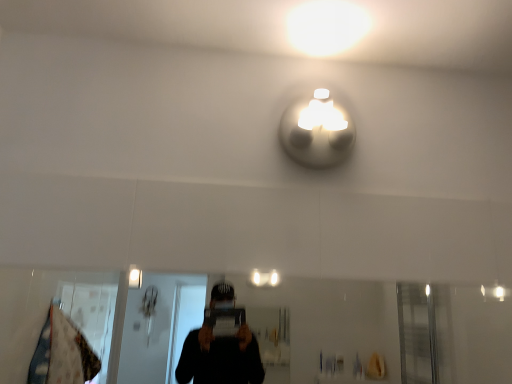
At what (x,y) coordinates should I click in order to perform the action: click on transparent glass mirror at lower center. Please return your answer as a coordinate pair (x, y). Looking at the image, I should click on (381, 330).

What do you see at coordinates (381, 330) in the screenshot?
I see `transparent glass mirror at lower center` at bounding box center [381, 330].

In order to face transparent glass mirror at lower center, should I rotate leftwards or rightwards?

Turn right by 2.178 degrees to look at transparent glass mirror at lower center.

What do you see at coordinates (317, 130) in the screenshot?
I see `white glossy light fixture at upper center` at bounding box center [317, 130].

Where is `white glossy light fixture at upper center`? This screenshot has height=384, width=512. white glossy light fixture at upper center is located at coordinates (317, 130).

I want to click on transparent glass mirror at lower center, so [x=381, y=330].

Which object is positioned more to the right, white glossy light fixture at upper center or transparent glass mirror at lower center?

Positioned to the right is white glossy light fixture at upper center.

Does white glossy light fixture at upper center lie in front of transparent glass mirror at lower center?

No, it is behind transparent glass mirror at lower center.

Considering the points (297, 118) and (418, 339), which point is behind, point (297, 118) or point (418, 339)?

The point (418, 339) is behind.

From the image's perspective, is white glossy light fixture at upper center over transparent glass mirror at lower center?

Yes.

From a real-world perspective, does white glossy light fixture at upper center sit lower than transparent glass mirror at lower center?

No, from a real-world perspective, white glossy light fixture at upper center is not beneath transparent glass mirror at lower center.

Can you confirm if white glossy light fixture at upper center is thinner than transparent glass mirror at lower center?

No.

From the picture: Can you confirm if white glossy light fixture at upper center is shorter than transparent glass mirror at lower center?

Yes, white glossy light fixture at upper center is shorter than transparent glass mirror at lower center.

Who is bigger, white glossy light fixture at upper center or transparent glass mirror at lower center?

With larger size is transparent glass mirror at lower center.

Does white glossy light fixture at upper center contain transparent glass mirror at lower center?

No, transparent glass mirror at lower center is not a part of white glossy light fixture at upper center.

Would you say white glossy light fixture at upper center is a long distance from transparent glass mirror at lower center?

Indeed, white glossy light fixture at upper center is not near transparent glass mirror at lower center.

Is white glossy light fixture at upper center oriented away from transparent glass mirror at lower center?

white glossy light fixture at upper center does not have its back to transparent glass mirror at lower center.

How different are the orientations of white glossy light fixture at upper center and transparent glass mirror at lower center in degrees?

0.00135 degrees.

Looking at this image, how much distance is there between white glossy light fixture at upper center and transparent glass mirror at lower center?

white glossy light fixture at upper center and transparent glass mirror at lower center are 5.32 feet apart from each other.

This screenshot has height=384, width=512. I want to click on light lying above the transparent glass mirror at lower center (from the image's perspective), so click(317, 130).

Which object is positioned more to the left, transparent glass mirror at lower center or white glossy light fixture at upper center?

transparent glass mirror at lower center is more to the left.

Is transparent glass mirror at lower center in front of or behind white glossy light fixture at upper center in the image?

In the image, transparent glass mirror at lower center appears in front of white glossy light fixture at upper center.

Which is less distant, (245,305) or (287,138)?

The point (287,138) is closer to the camera.

From the image's perspective, is transparent glass mirror at lower center located beneath white glossy light fixture at upper center?

Yes.

From a real-world perspective, is transparent glass mirror at lower center positioned under white glossy light fixture at upper center based on gravity?

Indeed, from a real-world perspective, transparent glass mirror at lower center is positioned beneath white glossy light fixture at upper center.

Considering the sizes of objects transparent glass mirror at lower center and white glossy light fixture at upper center in the image provided, who is thinner, transparent glass mirror at lower center or white glossy light fixture at upper center?

transparent glass mirror at lower center is thinner.

In the scene shown: Can you confirm if transparent glass mirror at lower center is shorter than white glossy light fixture at upper center?

No, transparent glass mirror at lower center is not shorter than white glossy light fixture at upper center.

Looking at the image, does transparent glass mirror at lower center seem bigger or smaller compared to white glossy light fixture at upper center?

In the image, transparent glass mirror at lower center appears to be larger than white glossy light fixture at upper center.

Is white glossy light fixture at upper center inside transparent glass mirror at lower center?

No, white glossy light fixture at upper center is not a part of transparent glass mirror at lower center.

Would you say transparent glass mirror at lower center is a long distance from white glossy light fixture at upper center?

transparent glass mirror at lower center is far away from white glossy light fixture at upper center.

Is transparent glass mirror at lower center looking in the opposite direction of white glossy light fixture at upper center?

No, transparent glass mirror at lower center is not facing the opposite direction of white glossy light fixture at upper center.

Locate an element on the screen. The width and height of the screenshot is (512, 384). mirror that appears in front of the white glossy light fixture at upper center is located at coordinates (381, 330).

You are a GUI agent. You are given a task and a screenshot of the screen. Output one action in this format:
    pyautogui.click(x=<x>, y=<y>)
    Task: Click on the light above the transparent glass mirror at lower center (from the image's perspective)
    The height and width of the screenshot is (384, 512).
    Given the screenshot: What is the action you would take?
    (317, 130)

The width and height of the screenshot is (512, 384). I want to click on light on the right of transparent glass mirror at lower center, so click(317, 130).